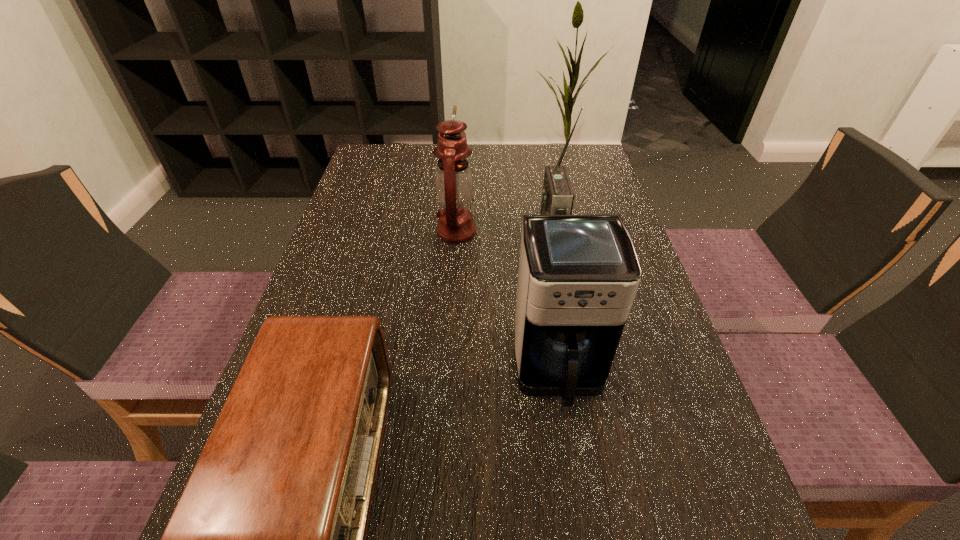
What are the coordinates of `vacant space that satisfies the following two spatial constraints: 1. on the display of the right radio receiver; 2. on the front panel of the coffee maker` in the screenshot? It's located at (578, 369).